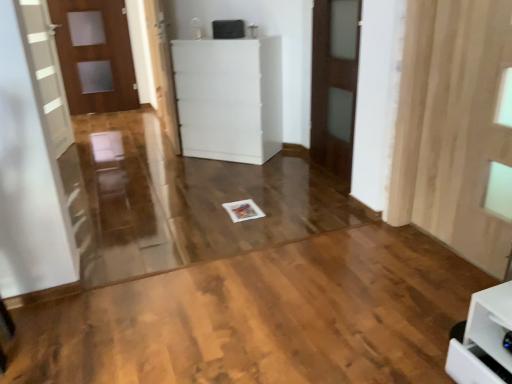
Identify the location of vacant area that lies in front of brown wooden door at center, which is counted as the 3th door, starting from the back. This screenshot has height=384, width=512. (319, 195).